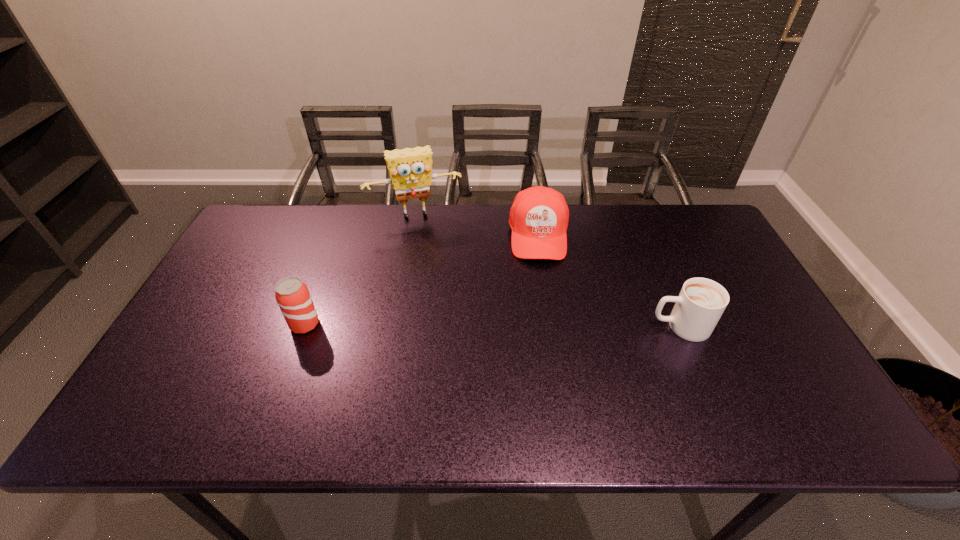
Image resolution: width=960 pixels, height=540 pixels. Identify the location of beer can. (292, 295).

Where is `the rightmost object`? This screenshot has width=960, height=540. the rightmost object is located at coordinates (701, 302).

Locate an element on the screen. This screenshot has width=960, height=540. the third object from right to left is located at coordinates (410, 169).

Identify the location of sponge. (410, 169).

You are a GUI agent. You are given a task and a screenshot of the screen. Output one action in this format:
    pyautogui.click(x=<x>, y=<y>)
    Task: Click on the baseball cap
    
    Given the screenshot: What is the action you would take?
    pyautogui.click(x=539, y=216)

Locate an element on the screen. The width and height of the screenshot is (960, 540). free space located on the right of the beer can is located at coordinates (464, 325).

At what (x,y) coordinates should I click in order to perform the action: click on free spot located 0.390m on the side with the handle of the rightmost object. Please return your answer as a coordinate pair (x, y). This screenshot has height=540, width=960. Looking at the image, I should click on (501, 326).

Locate an element on the screen. This screenshot has height=540, width=960. vacant region located 0.300m on the side with the handle of the rightmost object is located at coordinates (536, 326).

The height and width of the screenshot is (540, 960). I want to click on vacant space located on the side with the handle of the rightmost object, so click(528, 326).

I want to click on vacant space located 0.340m on the face of the sponge, so click(x=444, y=297).